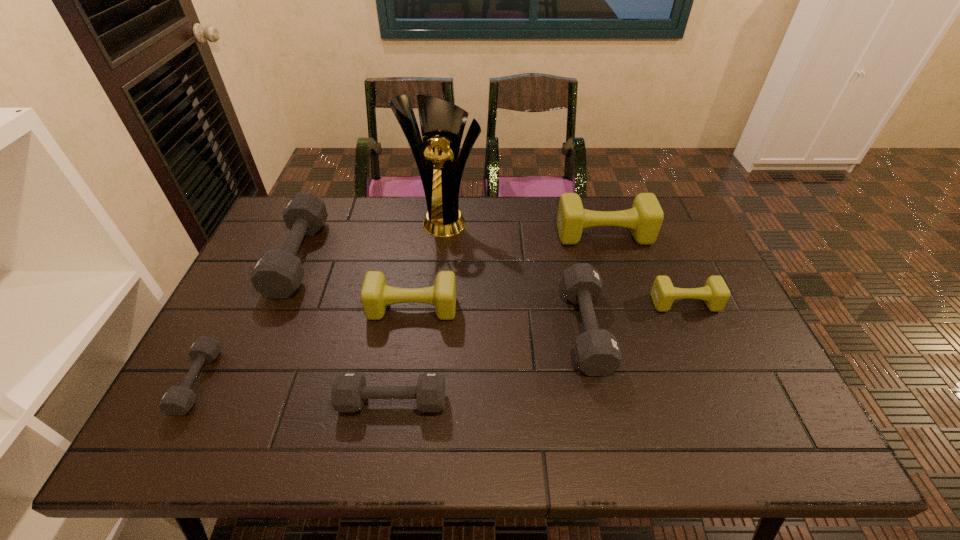
Find the location of a particular element. The height and width of the screenshot is (540, 960). the shortest dumbbell is located at coordinates (177, 400).

Identify the location of vacant area located 0.270m at the front of the tallest object, where the globe is visible. (437, 299).

Locate an element on the screen. This screenshot has height=540, width=960. free location located 0.090m on the back of the farthest olive dumbbell is located at coordinates (595, 207).

Identify the location of vacant area located on the right of the second dumbbell from left to right. (408, 257).

At what (x,y) coordinates should I click in order to perform the action: click on vacant area situated 0.120m on the right of the leftmost olive dumbbell. Please return your answer as a coordinate pair (x, y). The width and height of the screenshot is (960, 540). Looking at the image, I should click on (499, 308).

Where is `blank space located on the right of the rightmost gray dumbbell`? Image resolution: width=960 pixels, height=540 pixels. blank space located on the right of the rightmost gray dumbbell is located at coordinates (676, 328).

Locate an element on the screen. Image resolution: width=960 pixels, height=540 pixels. free region located 0.350m on the back of the third biggest gray dumbbell is located at coordinates (411, 281).

Locate an element on the screen. vacant space situated on the left of the smallest olive dumbbell is located at coordinates (556, 303).

At what (x,y) coordinates should I click in order to perform the action: click on free point located on the right of the shortest object. Please return your answer as a coordinate pair (x, y). The height and width of the screenshot is (540, 960). Looking at the image, I should click on (306, 381).

The width and height of the screenshot is (960, 540). Find the location of `award situated at the far edge`. award situated at the far edge is located at coordinates (442, 123).